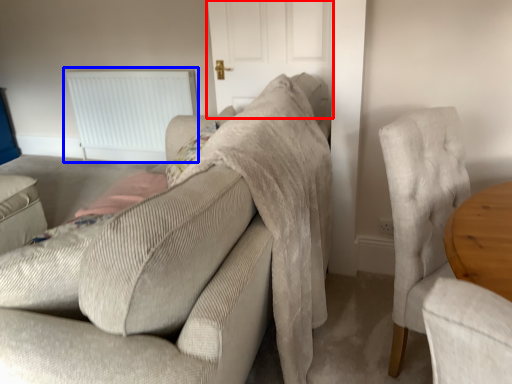
Question: Which of the following is the closest to the observer, door (highlighted by a red box) or radiator (highlighted by a blue box)?

Choices:
 (A) door
 (B) radiator

Answer: (A)